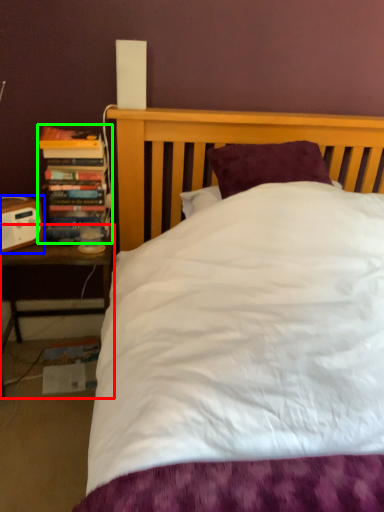
Question: Which object is the farthest from nightstand (highlighted by a red box)? Choose among these: speaker (highlighted by a blue box) or book (highlighted by a green box).

Choices:
 (A) speaker
 (B) book

Answer: (B)